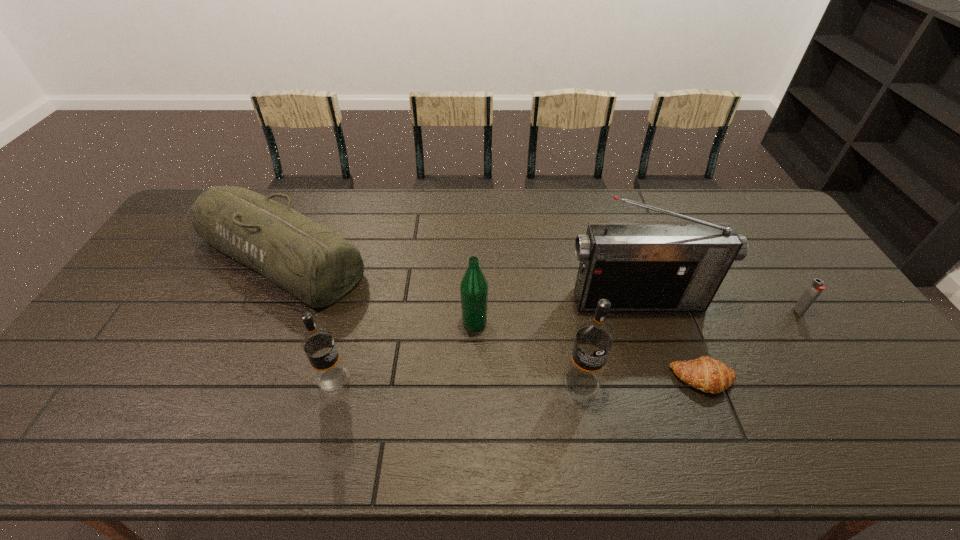
Find the location of a particular element. free region located 0.130m on the front-facing side of the tallest object is located at coordinates pos(655,352).

This screenshot has height=540, width=960. What are the coordinates of `free spot located 0.210m on the front of the third shortest object` in the screenshot? It's located at (225, 380).

This screenshot has width=960, height=540. Identify the location of vacant area located 0.250m on the left of the bottle. (372, 322).

Locate an element on the screen. The width and height of the screenshot is (960, 540). free space located 0.360m on the left of the igniter is located at coordinates (668, 311).

Image resolution: width=960 pixels, height=540 pixels. In order to click on free space located on the back of the shortest object in this screenshot , I will do [686, 337].

Find the location of a particular element. The image size is (960, 540). object located at the far edge is located at coordinates (311, 262).

The image size is (960, 540). In order to click on crescent roll located in the near edge section of the desktop in this screenshot , I will do `click(710, 375)`.

Identify the location of object that is positioned at the left edge. (311, 262).

Locate an element on the screen. This screenshot has width=960, height=540. object that is at the right edge is located at coordinates (816, 287).

Identify the location of object at the far left corner. The width and height of the screenshot is (960, 540). (311, 262).